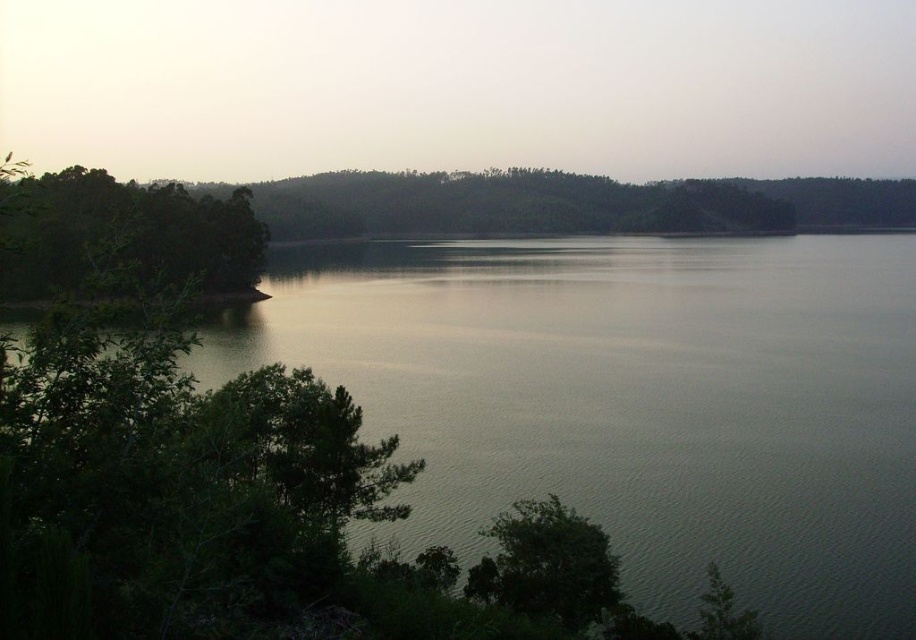
Measure the distance between greenish water at center and green leafy tree at lower left.

They are 73.36 meters apart.

Can you confirm if greenish water at center is bigger than green leafy tree at lower left?

Correct, greenish water at center is larger in size than green leafy tree at lower left.

Does point (537, 268) come in front of point (554, 552)?

No, (537, 268) is behind (554, 552).

Image resolution: width=916 pixels, height=640 pixels. I want to click on greenish water at center, so click(638, 400).

What do you see at coordinates (122, 236) in the screenshot? The height and width of the screenshot is (640, 916). I see `green leafy trees at left` at bounding box center [122, 236].

Does green leafy trees at left have a greater width compared to green leafy tree at lower left?

Correct, the width of green leafy trees at left exceeds that of green leafy tree at lower left.

Describe the element at coordinates (122, 236) in the screenshot. I see `green leafy trees at left` at that location.

The height and width of the screenshot is (640, 916). Identify the location of green leafy trees at left. (122, 236).

Can you confirm if greenish water at center is wider than green leafy trees at left?

Yes, greenish water at center is wider than green leafy trees at left.

Who is shorter, greenish water at center or green leafy trees at left?

With less height is greenish water at center.

Is point (679, 269) less distant than point (247, 259)?

That is False.

Image resolution: width=916 pixels, height=640 pixels. In order to click on greenish water at center in this screenshot , I will do `click(638, 400)`.